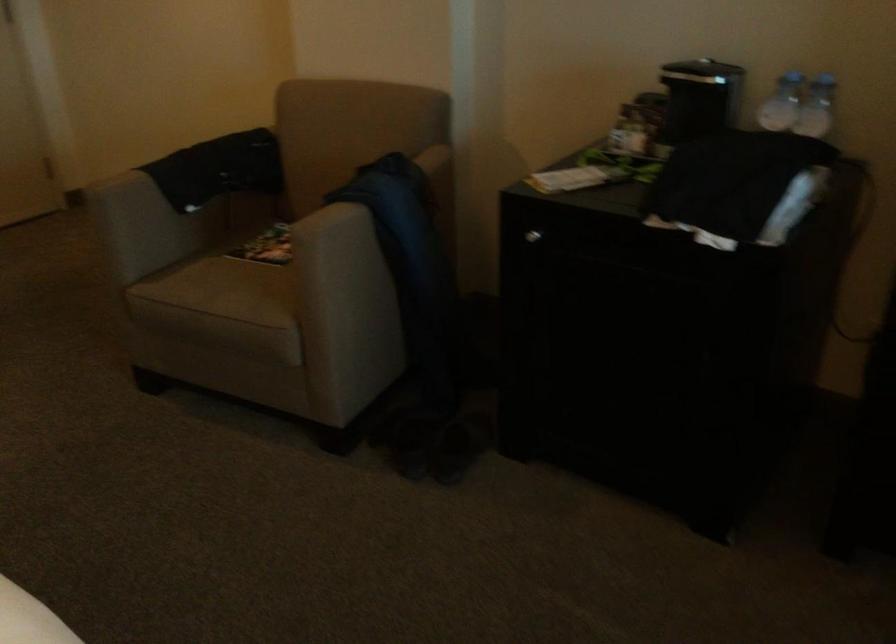
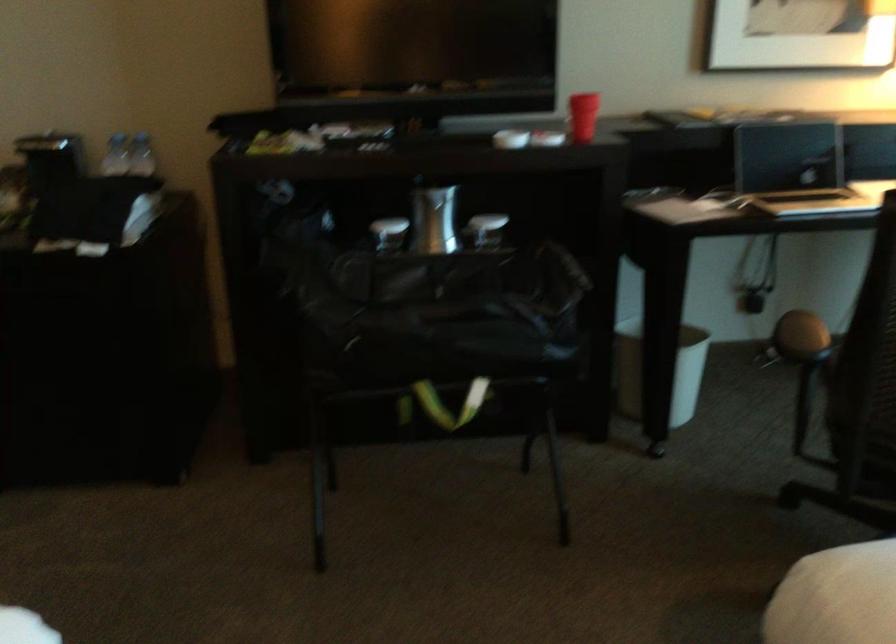
The point at (811, 102) is marked in the first image. Where is the corresponding point in the second image?

(141, 155)